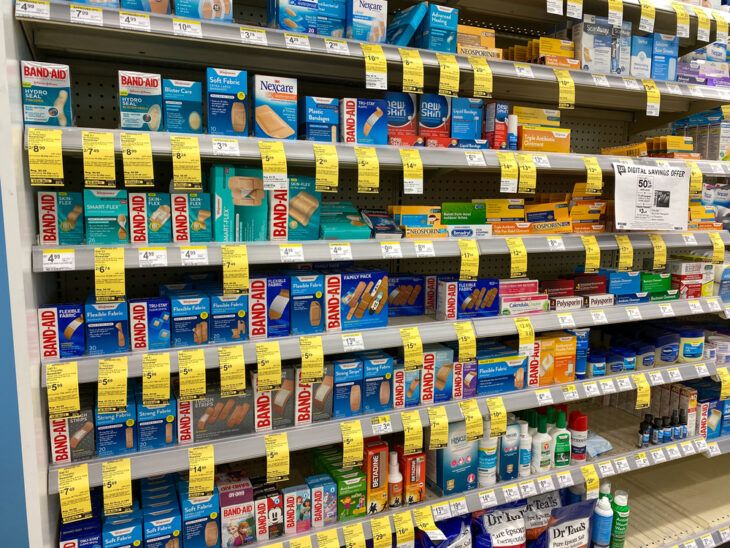
Image resolution: width=730 pixels, height=548 pixels. What are the coordinates of `white line on wall to the right` in the screenshot? It's located at (22, 387).